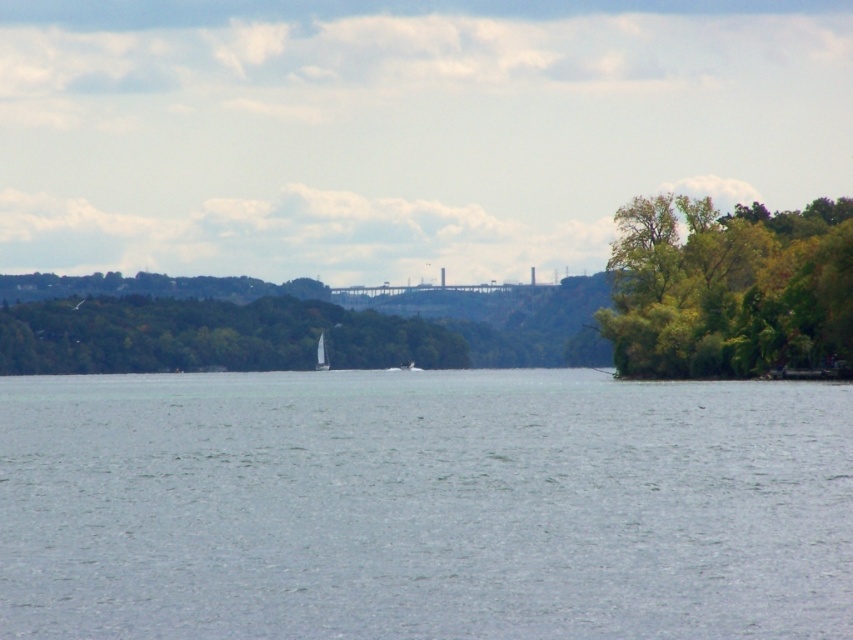
You are a photographer positioned at the lakeside. You want to capture a photo that includes both the green leafy trees at right and the white sailboat at center. Which object should you adjust your camera angle to focus on first to ensure both are in the frame?

The green leafy trees at right are in front of the white sailboat at center, so you should focus on the green leafy trees at right first to ensure both are in the frame.

You are standing at the lakeside and want to locate two specific points in the image. The first point is at coordinates point (840, 323) and the second is at point (318, 349). Which of these points is closer to your current position?

Point (840, 323) is closer to the camera than point (318, 349), so the first point is closer to your current position.

You are a photographer planning to take a landscape photo of the clear water at center and the white sailboat at center. Based on their positions, which object should appear closer to the bottom of the photo?

The clear water at center is not as tall as the white sailboat at center, so the clear water at center should appear closer to the bottom of the photo.